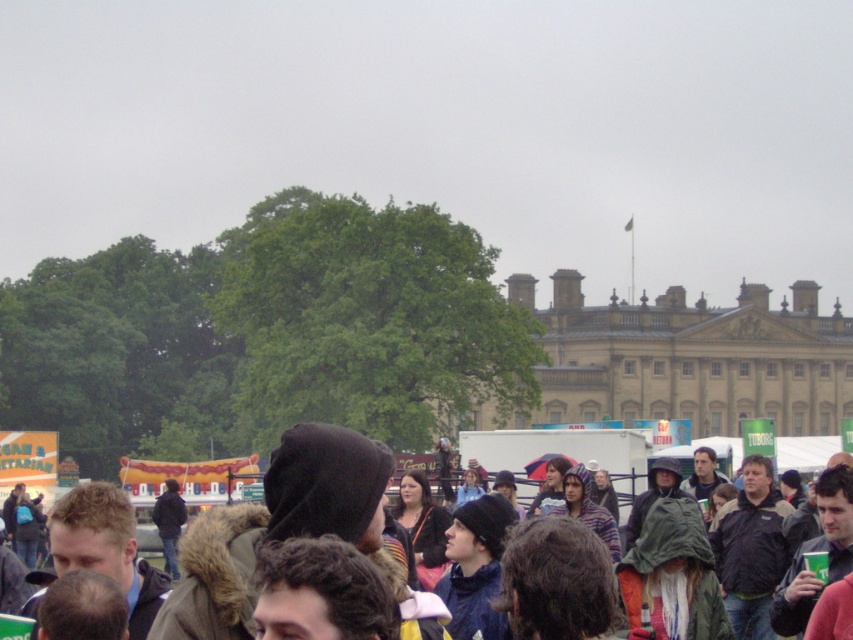
Based on the scene description, what is the 2D coordinate of the beige stone building at center?

The 2D coordinate of the beige stone building at center is at point (691, 358).

You are standing in the crowd at the event and want to take a photo of the dark brown hood at center without the beige stone building at center blocking it. How should you adjust your position?

To avoid the beige stone building at center blocking the dark brown hood at center, you should lower your camera angle or move to a lower position since the beige stone building at center is above the dark brown hood at center.

You are standing at the event and want to take a photo of the beige stone building at center. If your camera has a maximum zoom range of 100 meters, will you be able to capture the entire building in your photo without moving closer?

The beige stone building at center is 142.48 meters away from the viewer. Since the camera can only zoom up to 100 meters, you won cannot capture the entire building without moving closer.